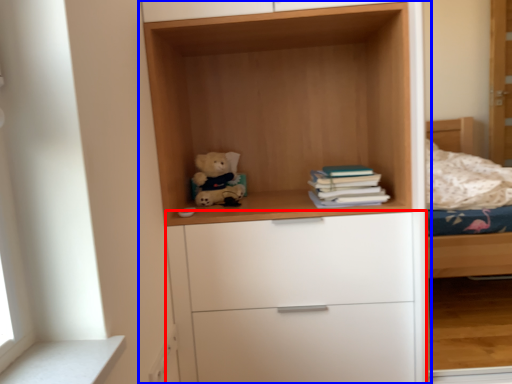
Question: Which point is closer to the camera, chest of drawers (highlighted by a red box) or cupboard (highlighted by a blue box)?

Choices:
 (A) chest of drawers
 (B) cupboard

Answer: (B)